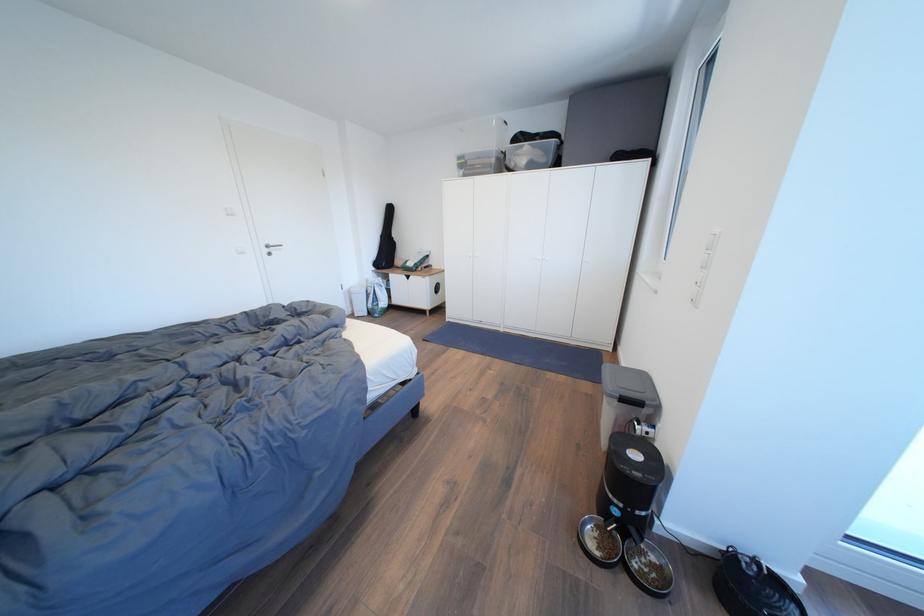
Where is `grey storage bin`? The image size is (924, 616). grey storage bin is located at coordinates pos(626,379).